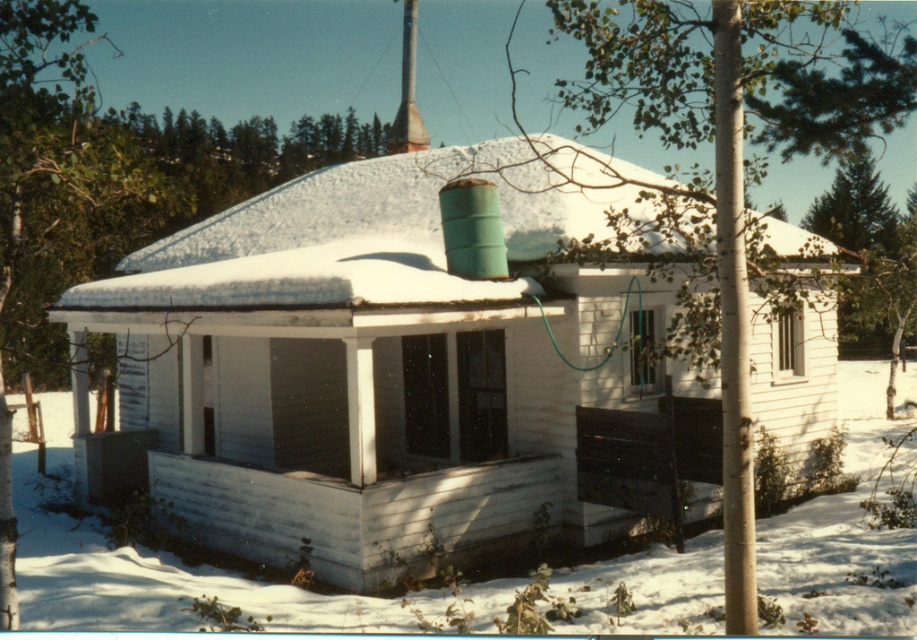
In the scene shown: Which of these two, green leafy tree at upper left or white shingles at upper center, stands taller?

green leafy tree at upper left

Who is more distant from viewer, (17, 35) or (661, 241)?

The point (661, 241) is more distant.

Identify the location of green leafy tree at upper left. (113, 172).

Is green leafy tree at center wider than green leafy tree at upper left?

No, green leafy tree at center is not wider than green leafy tree at upper left.

Is point (880, 120) behind point (0, 180)?

Yes, it is behind point (0, 180).

Is point (832, 132) behind point (244, 188)?

No, (832, 132) is closer to viewer.

What are the coordinates of `green leafy tree at center` in the screenshot? It's located at (737, 147).

Is white painted wood cabin at center shorter than green leafy tree at center?

Yes.

Is point (444, 394) positioned in front of point (704, 28)?

Yes, it is.

Is point (660, 380) farther from viewer compared to point (636, 77)?

No, (660, 380) is in front of (636, 77).

Find the location of a particular element. white painted wood cabin at center is located at coordinates (380, 364).